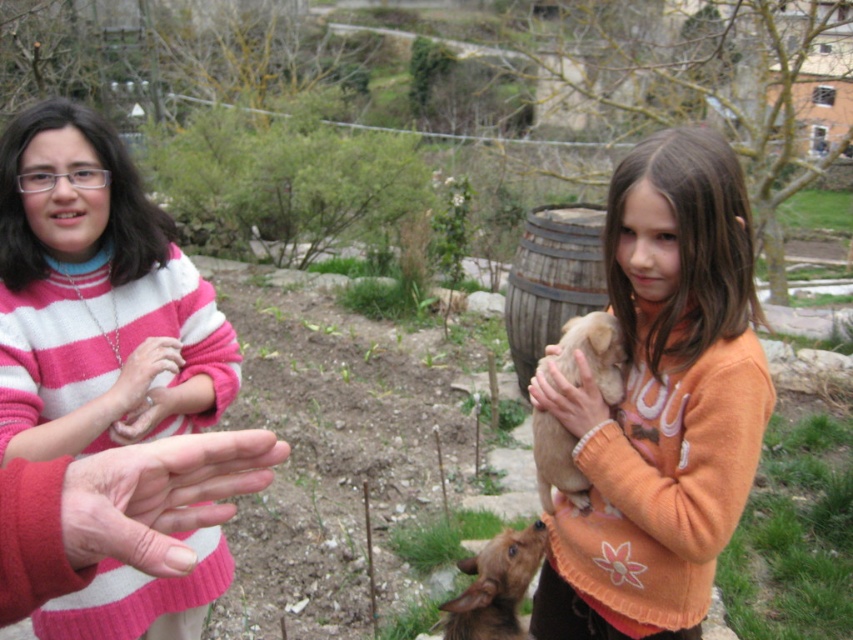
Between point (680, 273) and point (511, 637), which one is positioned in front?

Point (680, 273) is in front.

Does orange fleece sweater at center have a greater width compared to brown furry dog at lower center?

Yes.

What do you see at coordinates (660, 403) in the screenshot? I see `orange fleece sweater at center` at bounding box center [660, 403].

In order to click on orange fleece sweater at center in this screenshot , I will do `click(660, 403)`.

From the picture: Is pink striped sweater at left to the left of matte pink sweater at left from the viewer's perspective?

Yes, pink striped sweater at left is to the left of matte pink sweater at left.

Is pink striped sweater at left taller than matte pink sweater at left?

Correct, pink striped sweater at left is much taller as matte pink sweater at left.

You are a GUI agent. You are given a task and a screenshot of the screen. Output one action in this format:
    pyautogui.click(x=<x>, y=<y>)
    Task: Click on the pink striped sweater at left
    The image size is (853, 640).
    Given the screenshot: What is the action you would take?
    pyautogui.click(x=91, y=291)

Who is shorter, pink striped sweater at left or light brown fur at center?

light brown fur at center

Identify the location of pink striped sweater at left. (91, 291).

In order to click on pink striped sweater at left in this screenshot , I will do `click(91, 291)`.

At what (x,y) coordinates should I click in order to perform the action: click on pink striped sweater at left. Please return your answer as a coordinate pair (x, y). Image resolution: width=853 pixels, height=640 pixels. Looking at the image, I should click on point(91,291).